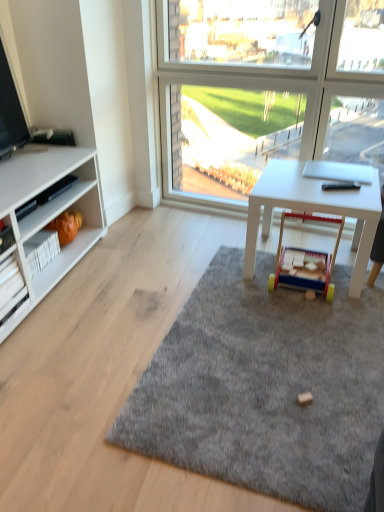
Locate an element on the screen. This screenshot has width=384, height=512. empty space that is to the right of orange fabric toy at lower left, the 2th toy in the right-to-left sequence is located at coordinates (97, 246).